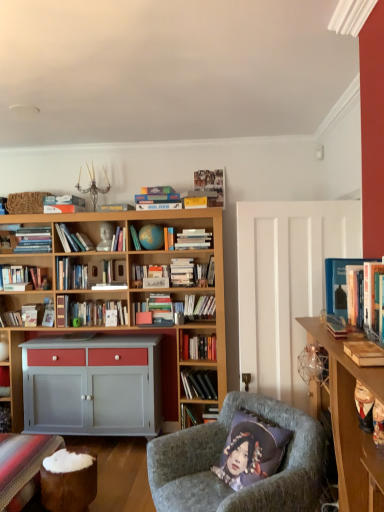
Question: Which direction should I rotate to face hardcover books at center, which is counted as the 5th book, starting from the back, — up or down?

Choices:
 (A) up
 (B) down

Answer: (B)

Question: Considering the relative sizes of white matte bookshelf at center, the 5th book positioned from the right, and hardcover books at left, which appears as the eleventh book when viewed from the right, in the image provided, is white matte bookshelf at center, the 5th book positioned from the right, thinner than hardcover books at left, which appears as the eleventh book when viewed from the right,?

Choices:
 (A) no
 (B) yes

Answer: (B)

Question: Is the position of white matte bookshelf at center, which appears as the 3th book when viewed from the front, less distant than that of hardcover books at left, which ranks as the second book in left-to-right order?

Choices:
 (A) yes
 (B) no

Answer: (A)

Question: From a real-world perspective, is white matte bookshelf at center, which appears as the 3th book when viewed from the front, over hardcover books at left, which ranks as the second book in left-to-right order?

Choices:
 (A) yes
 (B) no

Answer: (B)

Question: Are white matte bookshelf at center, which appears as the 3th book when viewed from the front, and hardcover books at left, which appears as the eleventh book when viewed from the right, located far from each other?

Choices:
 (A) yes
 (B) no

Answer: (A)

Question: From the image's perspective, is white matte bookshelf at center, the 5th book positioned from the right, located beneath hardcover books at left, which appears as the eleventh book when viewed from the right?

Choices:
 (A) yes
 (B) no

Answer: (B)

Question: Does white matte bookshelf at center, the 5th book positioned from the right, appear on the left side of hardcover books at left, which is the third book in back-to-front order?

Choices:
 (A) no
 (B) yes

Answer: (A)

Question: Considering the relative sizes of hardcover book at center-left, the 2th book from the back, and teal globe at center in the image provided, is hardcover book at center-left, the 2th book from the back, taller than teal globe at center?

Choices:
 (A) no
 (B) yes

Answer: (B)

Question: Does hardcover book at center-left, positioned as the 3th book in left-to-right order, turn towards teal globe at center?

Choices:
 (A) yes
 (B) no

Answer: (B)

Question: Considering the relative sizes of hardcover book at center-left, which ranks as the 10th book in right-to-left order, and teal globe at center in the image provided, is hardcover book at center-left, which ranks as the 10th book in right-to-left order, wider than teal globe at center?

Choices:
 (A) yes
 (B) no

Answer: (A)

Question: From a real-world perspective, is hardcover book at center-left, the 2th book from the back, on teal globe at center?

Choices:
 (A) yes
 (B) no

Answer: (B)

Question: Is hardcover book at center-left, the 2th book from the back, to the left of teal globe at center from the viewer's perspective?

Choices:
 (A) no
 (B) yes

Answer: (B)

Question: Is hardcover book at center-left, the eleventh book viewed from the front, smaller than teal globe at center?

Choices:
 (A) yes
 (B) no

Answer: (A)

Question: Is velvet grey armchair at center surrounding hardcover book at left, which appears as the twelfth book when viewed from the right?

Choices:
 (A) no
 (B) yes

Answer: (A)